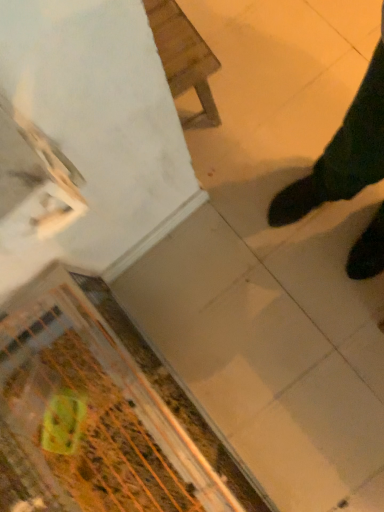
Question: Is wooden chair at upper center bigger or smaller than green plastic bag at lower left?

Choices:
 (A) small
 (B) big

Answer: (B)

Question: Does point (165, 32) appear closer or farther from the camera than point (84, 384)?

Choices:
 (A) farther
 (B) closer

Answer: (A)

Question: In terms of height, does wooden chair at upper center look taller or shorter compared to green plastic bag at lower left?

Choices:
 (A) tall
 (B) short

Answer: (A)

Question: Looking at the image, does green plastic bag at lower left seem bigger or smaller compared to wooden chair at upper center?

Choices:
 (A) big
 (B) small

Answer: (B)

Question: From a real-world perspective, relative to wooden chair at upper center, is green plastic bag at lower left vertically above or below?

Choices:
 (A) below
 (B) above

Answer: (B)

Question: Is point (56, 339) positioned closer to the camera than point (203, 52)?

Choices:
 (A) farther
 (B) closer

Answer: (B)

Question: Is green plastic bag at lower left in front of or behind wooden chair at upper center in the image?

Choices:
 (A) front
 (B) behind

Answer: (A)